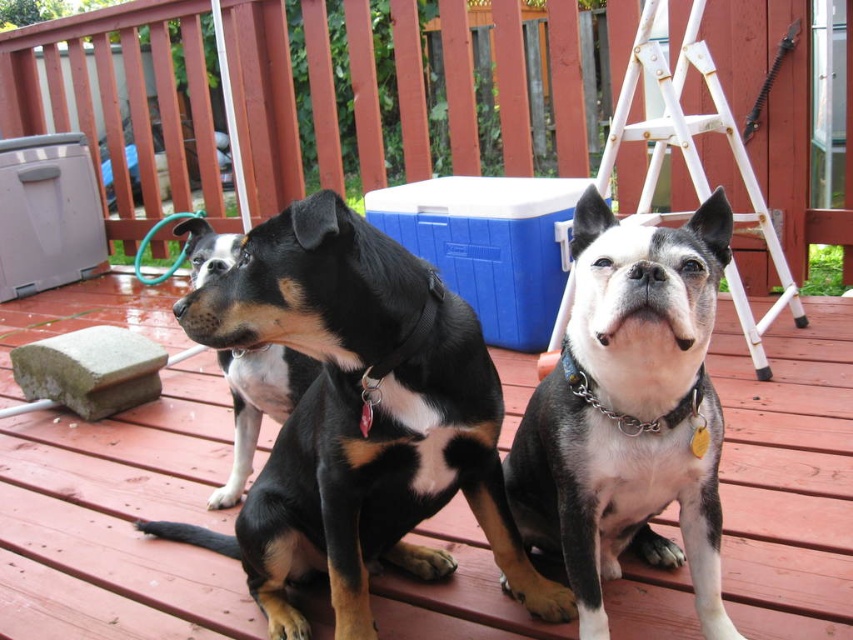
Question: Among these points, which one is farthest from the camera?

Choices:
 (A) (381, 196)
 (B) (651, 195)
 (C) (393, 525)
 (D) (664, 273)

Answer: (A)

Question: Which point appears closest to the camera in this image?

Choices:
 (A) (248, 442)
 (B) (614, 552)

Answer: (B)

Question: Does black matte dog at center lie in front of white/black fur dog at center?

Choices:
 (A) yes
 (B) no

Answer: (B)

Question: Which point is farther from the camera taking this photo?

Choices:
 (A) (581, 340)
 (B) (242, 486)
 (C) (838, 572)

Answer: (B)

Question: Is the position of white/black fur dog at center less distant than that of black matte dog at left?

Choices:
 (A) yes
 (B) no

Answer: (A)

Question: Does blue plastic cooler at center lie behind black matte dog at left?

Choices:
 (A) yes
 (B) no

Answer: (A)